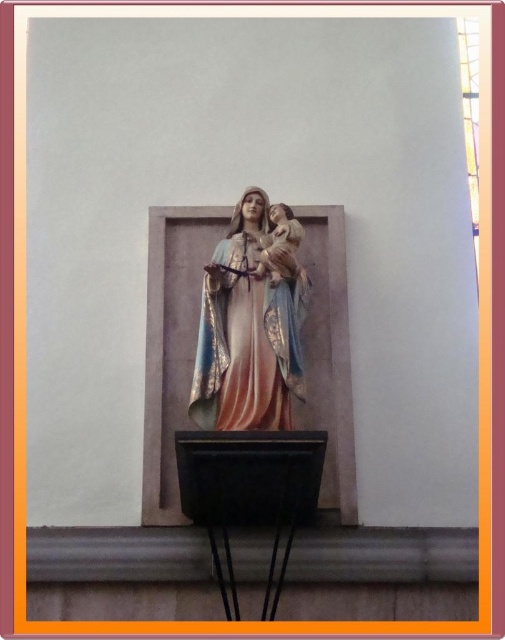
Is matte painted statue at center above transparent glass window at upper right?

No.

Is matte painted statue at center further to the viewer compared to transparent glass window at upper right?

That is False.

The width and height of the screenshot is (505, 640). Find the location of `matte painted statue at center`. matte painted statue at center is located at coordinates (248, 326).